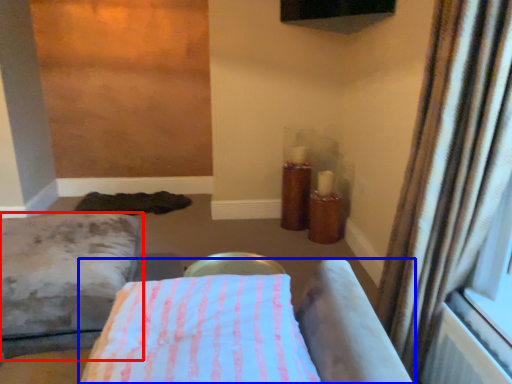
Question: Among these objects, which one is nearest to the camera, furniture (highlighted by a red box) or furniture (highlighted by a blue box)?

Choices:
 (A) furniture
 (B) furniture

Answer: (B)